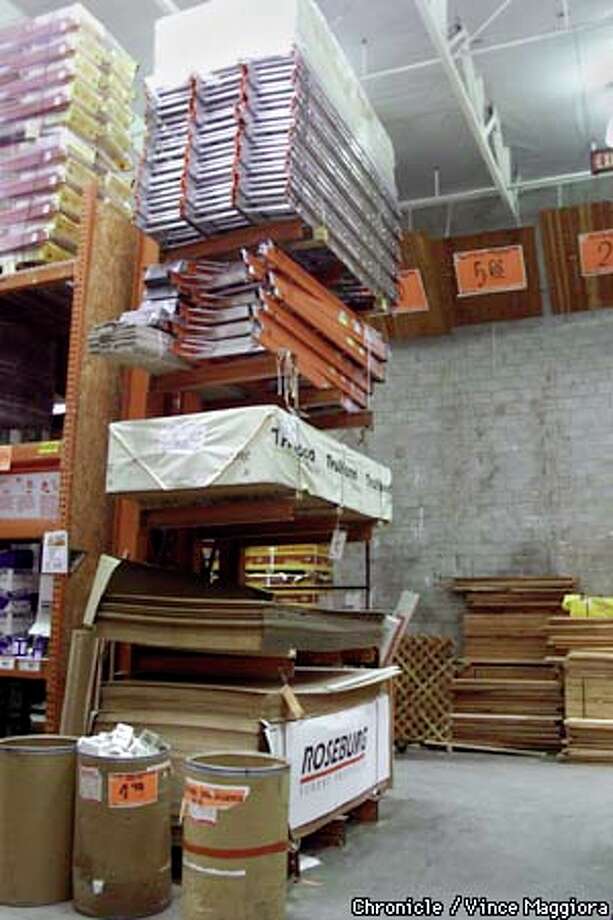
Where is `shelf`? This screenshot has height=920, width=613. shelf is located at coordinates (189, 520).